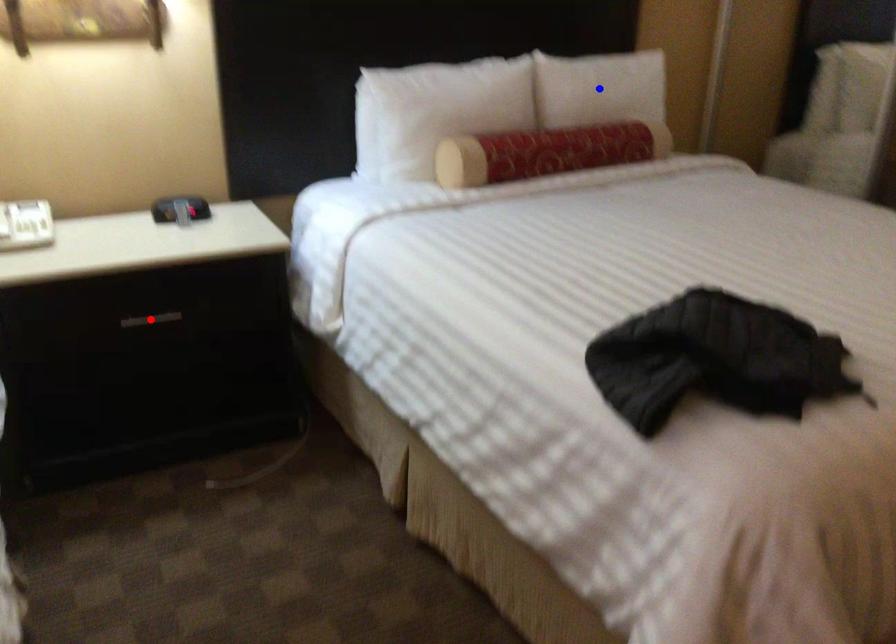
Question: Two points are marked on the image. Which point is closer to the camera?

Choices:
 (A) Blue point is closer.
 (B) Red point is closer.

Answer: (B)